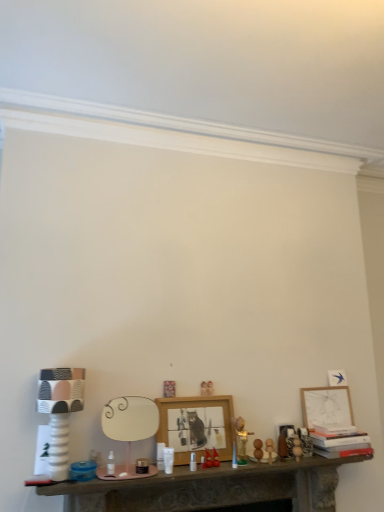
How much space does wooden picture frame at center, positioned as the first picture frame in front-to-back order, occupy horizontally?

14.20 centimeters.

Describe the element at coordinates (258, 449) in the screenshot. I see `smooth wooden eggs at center, positioned as the first toy in left-to-right order` at that location.

Where is `smooth stone table at center`? The height and width of the screenshot is (512, 384). smooth stone table at center is located at coordinates (211, 488).

This screenshot has height=512, width=384. What do you see at coordinates (297, 447) in the screenshot?
I see `wooden ball at center, which ranks as the second toy in left-to-right order` at bounding box center [297, 447].

At what (x,y) coordinates should I click in order to perform the action: click on wooden ball at center, which ranks as the second toy in left-to-right order. Please return your answer as a coordinate pair (x, y). This screenshot has height=512, width=384. Looking at the image, I should click on (297, 447).

Locate an element on the screen. matte white picture frame at right, which ranks as the 2th picture frame in left-to-right order is located at coordinates (326, 406).

Are wooden picture frame at center, arranged as the 2th picture frame when viewed from the right, and smooth wooden eggs at center, arranged as the 2th toy when viewed from the right, far apart?

No.

Considering the relative positions of wooden picture frame at center, placed as the second picture frame when sorted from back to front, and smooth wooden eggs at center, positioned as the first toy in left-to-right order, in the image provided, is wooden picture frame at center, placed as the second picture frame when sorted from back to front, to the left or to the right of smooth wooden eggs at center, positioned as the first toy in left-to-right order,?

wooden picture frame at center, placed as the second picture frame when sorted from back to front, is positioned on smooth wooden eggs at center, positioned as the first toy in left-to-right order,'s left side.

Where is `the 1st picture frame above the smooth wooden eggs at center, positioned as the first toy in left-to-right order (from the image's perspective)`? The height and width of the screenshot is (512, 384). the 1st picture frame above the smooth wooden eggs at center, positioned as the first toy in left-to-right order (from the image's perspective) is located at coordinates (196, 426).

I want to click on lamp lying in front of the smooth wooden eggs at center, arranged as the 2th toy when viewed from the right, so click(x=60, y=412).

From a real-world perspective, is white textured lamp at left positioned over smooth wooden eggs at center, positioned as the first toy in left-to-right order, based on gravity?

Yes, from a real-world perspective, white textured lamp at left is over smooth wooden eggs at center, positioned as the first toy in left-to-right order

Between white textured lamp at left and smooth wooden eggs at center, positioned as the first toy in left-to-right order, which one appears on the right side from the viewer's perspective?

smooth wooden eggs at center, positioned as the first toy in left-to-right order, is more to the right.

Does wooden picture frame at center, arranged as the 2th picture frame when viewed from the right, have a greater height compared to smooth stone table at center?

Indeed, wooden picture frame at center, arranged as the 2th picture frame when viewed from the right, has a greater height compared to smooth stone table at center.

How distant is wooden picture frame at center, marked as the 1th picture frame in a left-to-right arrangement, from smooth stone table at center?

wooden picture frame at center, marked as the 1th picture frame in a left-to-right arrangement, is 24.10 centimeters from smooth stone table at center.

From the image's perspective, is wooden picture frame at center, arranged as the 2th picture frame when viewed from the right, below smooth stone table at center?

No.

Considering their positions, is smooth wooden eggs at center, positioned as the first toy in left-to-right order, located in front of or behind smooth stone table at center?

Clearly, smooth wooden eggs at center, positioned as the first toy in left-to-right order, is behind smooth stone table at center.

In terms of size, does smooth wooden eggs at center, arranged as the 2th toy when viewed from the right, appear bigger or smaller than smooth stone table at center?

Considering their sizes, smooth wooden eggs at center, arranged as the 2th toy when viewed from the right, takes up less space than smooth stone table at center.

Between point (259, 451) and point (329, 509), which one is positioned in front?

The point (259, 451) is closer to the camera.

Is white textured lamp at left taller than matte white picture frame at right, acting as the first picture frame starting from the right?

Correct, white textured lamp at left is much taller as matte white picture frame at right, acting as the first picture frame starting from the right.

Considering the points (78, 380) and (333, 420), which point is in front, point (78, 380) or point (333, 420)?

The point (78, 380) is closer.

Which is correct: white textured lamp at left is inside matte white picture frame at right, the first picture frame from the back, or outside of it?

The correct answer is: outside.

Between white textured lamp at left and matte white picture frame at right, which ranks as the 2th picture frame in left-to-right order, which one appears on the right side from the viewer's perspective?

matte white picture frame at right, which ranks as the 2th picture frame in left-to-right order.

From a real-world perspective, between smooth stone table at center and matte white picture frame at right, the first picture frame from the back, who is vertically higher?

From a 3D spatial view, matte white picture frame at right, the first picture frame from the back, is above.

Does point (74, 503) come in front of point (349, 424)?

Yes, point (74, 503) is closer to viewer.

Is smooth stone table at center next to matte white picture frame at right, acting as the first picture frame starting from the right, and touching it?

No, smooth stone table at center is not making contact with matte white picture frame at right, acting as the first picture frame starting from the right.

The image size is (384, 512). There is a smooth stone table at center. Find the location of `the 2nd picture frame above it (from the image's perspective)`. the 2nd picture frame above it (from the image's perspective) is located at coordinates (326, 406).

From the image's perspective, which is below, wooden ball at center, the 1th toy viewed from the right, or smooth stone table at center?

smooth stone table at center.

Which of these two, wooden ball at center, the 1th toy viewed from the right, or smooth stone table at center, is bigger?

Bigger between the two is smooth stone table at center.

How different are the orientations of wooden ball at center, which ranks as the second toy in left-to-right order, and smooth stone table at center in degrees?

3.24 degrees.

From the image's perspective, count 1st toys downward from the wooden picture frame at center, marked as the 1th picture frame in a left-to-right arrangement, and point to it. Please provide its 2D coordinates.

[(258, 449)]

Locate an element on the screen. toy that is the 1st object to the right of the white textured lamp at left, starting at the anchor is located at coordinates (258, 449).

From the picture: Based on their spatial positions, is wooden ball at center, which ranks as the second toy in left-to-right order, or wooden picture frame at center, placed as the second picture frame when sorted from back to front, further from white textured lamp at left?

wooden ball at center, which ranks as the second toy in left-to-right order, is positioned further to the anchor white textured lamp at left.

Considering their positions, is matte white picture frame at right, which ranks as the 2th picture frame in left-to-right order, positioned closer to wooden picture frame at center, arranged as the 2th picture frame when viewed from the right, than wooden ball at center, which ranks as the second toy in left-to-right order?

wooden ball at center, which ranks as the second toy in left-to-right order, is closer to wooden picture frame at center, arranged as the 2th picture frame when viewed from the right.

Considering their positions, is wooden ball at center, which ranks as the second toy in left-to-right order, positioned closer to smooth wooden eggs at center, arranged as the 2th toy when viewed from the right, than matte white picture frame at right, arranged as the 2th picture frame when viewed from the front?

wooden ball at center, which ranks as the second toy in left-to-right order, is closer to smooth wooden eggs at center, arranged as the 2th toy when viewed from the right.

From the image, which object appears to be farther from smooth wooden eggs at center, positioned as the first toy in left-to-right order, smooth stone table at center or wooden picture frame at center, placed as the second picture frame when sorted from back to front?

smooth stone table at center.

Considering their positions, is wooden picture frame at center, placed as the second picture frame when sorted from back to front, positioned further to matte white picture frame at right, which ranks as the 2th picture frame in left-to-right order, than smooth stone table at center?

wooden picture frame at center, placed as the second picture frame when sorted from back to front, is further to matte white picture frame at right, which ranks as the 2th picture frame in left-to-right order.

From the image, which object appears to be nearer to wooden ball at center, the 1th toy viewed from the right, smooth wooden eggs at center, positioned as the first toy in left-to-right order, or matte white picture frame at right, acting as the first picture frame starting from the right?

smooth wooden eggs at center, positioned as the first toy in left-to-right order, is closer to wooden ball at center, the 1th toy viewed from the right.

Considering their positions, is wooden ball at center, the 1th toy viewed from the right, positioned further to smooth wooden eggs at center, arranged as the 2th toy when viewed from the right, than white textured lamp at left?

Among the two, white textured lamp at left is located further to smooth wooden eggs at center, arranged as the 2th toy when viewed from the right.

Estimate the real-world distances between objects in this image. Which object is closer to smooth wooden eggs at center, positioned as the first toy in left-to-right order, matte white picture frame at right, which ranks as the 2th picture frame in left-to-right order, or wooden picture frame at center, positioned as the first picture frame in front-to-back order?

wooden picture frame at center, positioned as the first picture frame in front-to-back order.

What are the coordinates of `picture frame between white textured lamp at left and smooth stone table at center` in the screenshot? It's located at (196, 426).

The height and width of the screenshot is (512, 384). I want to click on picture frame between smooth stone table at center and smooth wooden eggs at center, positioned as the first toy in left-to-right order, along the z-axis, so (x=196, y=426).

Locate an element on the screen. picture frame between white textured lamp at left and wooden ball at center, the 1th toy viewed from the right, from left to right is located at coordinates (196, 426).

Identify the location of table between wooden picture frame at center, placed as the second picture frame when sorted from back to front, and wooden ball at center, which ranks as the second toy in left-to-right order, in the horizontal direction. (211, 488).